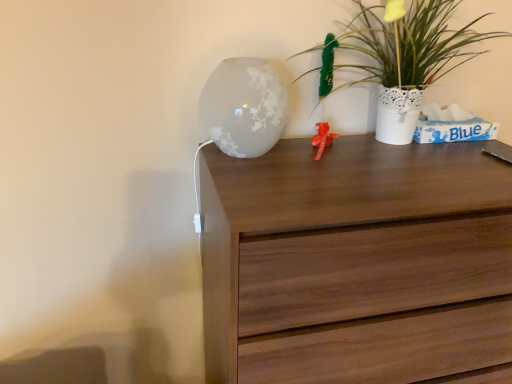
Where is `vacant space underneath frosted glass vase at upper center (from a real-world perspective)`? This screenshot has height=384, width=512. vacant space underneath frosted glass vase at upper center (from a real-world perspective) is located at coordinates (248, 158).